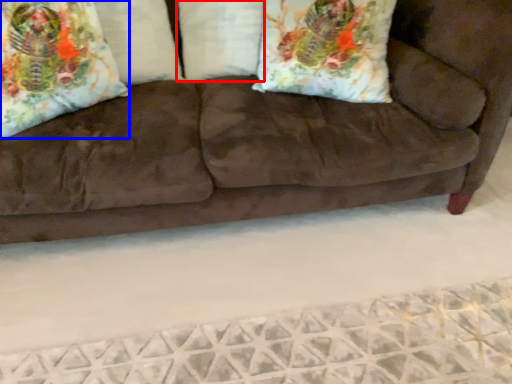
Question: Which point is further to the camera, pillow (highlighted by a red box) or throw pillow (highlighted by a blue box)?

Choices:
 (A) pillow
 (B) throw pillow

Answer: (A)